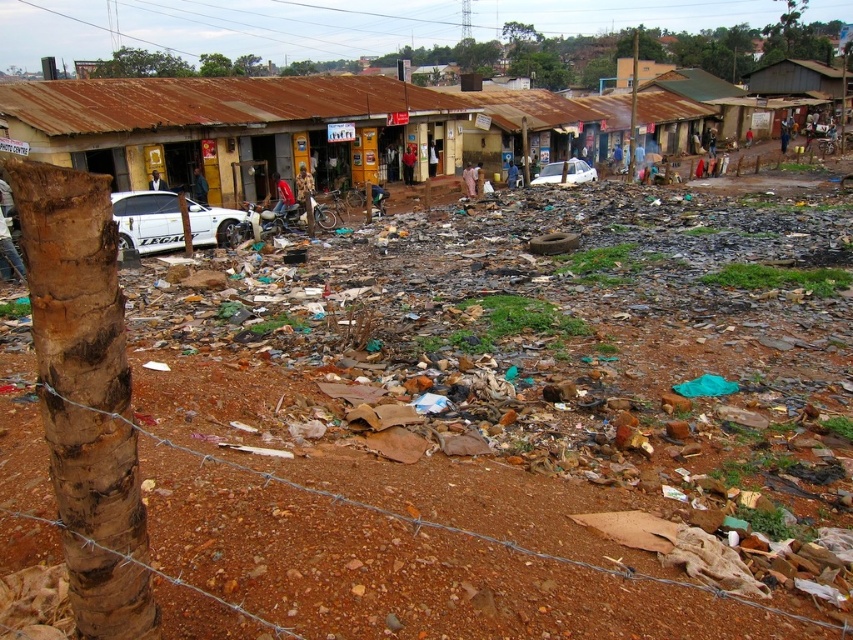
Question: Is white matte car at left above white matte car at center?

Choices:
 (A) yes
 (B) no

Answer: (B)

Question: Which of the following is the closest to the observer?

Choices:
 (A) rusty metal shacks at center
 (B) white matte car at left

Answer: (B)

Question: Which object is the farthest from the white matte car at center?

Choices:
 (A) rusty metal shacks at center
 (B) white matte car at left

Answer: (A)

Question: Among these points, which one is nearest to the camera?

Choices:
 (A) (102, 147)
 (B) (581, 172)

Answer: (A)

Question: Does rusty metal shacks at center appear over white matte car at left?

Choices:
 (A) yes
 (B) no

Answer: (A)

Question: Considering the relative positions of rusty metal shacks at center and white matte car at center in the image provided, where is rusty metal shacks at center located with respect to white matte car at center?

Choices:
 (A) left
 (B) right

Answer: (A)